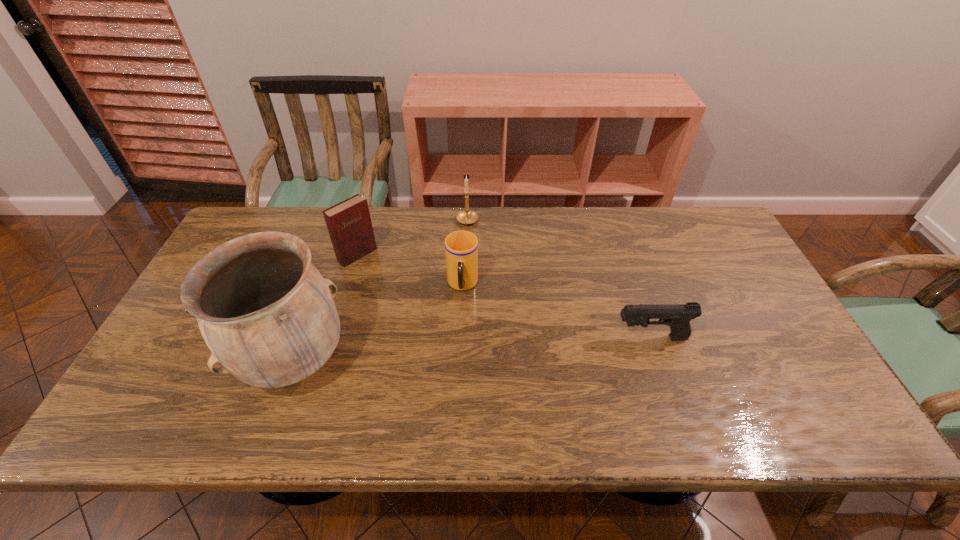
At what (x,y) coordinates should I click in order to perform the action: click on empty space between the second farthest object and the farthest object. Please return your answer as a coordinate pair (x, y). Image resolution: width=960 pixels, height=540 pixels. Looking at the image, I should click on [x=413, y=239].

Locate an element on the screen. Image resolution: width=960 pixels, height=540 pixels. unoccupied area between the fourth nearest object and the candle holder is located at coordinates (413, 239).

Locate an element on the screen. The height and width of the screenshot is (540, 960). blank region between the cup and the rightmost object is located at coordinates (557, 312).

Point out which object is positioned as the second nearest to the candle holder. Please provide its 2D coordinates. Your answer should be formatted as a tuple, i.e. [(x, y)], where the tuple contains the x and y coordinates of a point satisfying the conditions above.

[(349, 224)]

Select which object is the third closest to the fourth nearest object. Please provide its 2D coordinates. Your answer should be formatted as a tuple, i.e. [(x, y)], where the tuple contains the x and y coordinates of a point satisfying the conditions above.

[(467, 216)]

Image resolution: width=960 pixels, height=540 pixels. What are the coordinates of `vacant space that satisfies the following two spatial constraints: 1. on the back side of the urn; 2. at the barrel of the rightmost object` in the screenshot? It's located at (302, 338).

Image resolution: width=960 pixels, height=540 pixels. Identify the location of free location that satisfies the following two spatial constraints: 1. on the front side of the cup; 2. at the barrel of the rightmost object. (461, 338).

You are a GUI agent. You are given a task and a screenshot of the screen. Output one action in this format:
    pyautogui.click(x=<x>, y=<y>)
    Task: Click on the vacant area in the image that satisfies the following two spatial constraints: 1. on the back side of the farthest object; 2. on the right side of the fourth nearest object
    Image resolution: width=960 pixels, height=540 pixels.
    Given the screenshot: What is the action you would take?
    pyautogui.click(x=367, y=222)

The height and width of the screenshot is (540, 960). What are the coordinates of `free space that satisfies the following two spatial constraints: 1. on the front side of the pistol; 2. at the barrel of the third farthest object` in the screenshot? It's located at (461, 338).

Identify the location of vacant space that satisfies the following two spatial constraints: 1. on the front side of the fourth nearest object; 2. at the barrel of the rightmost object. The width and height of the screenshot is (960, 540). (333, 338).